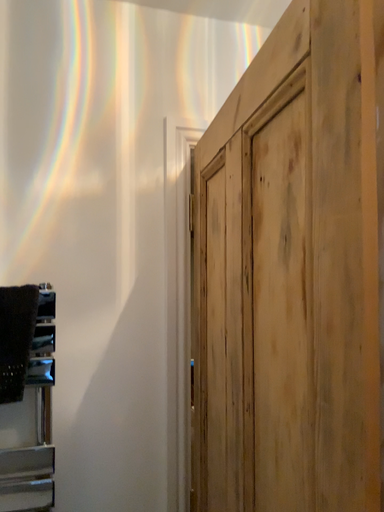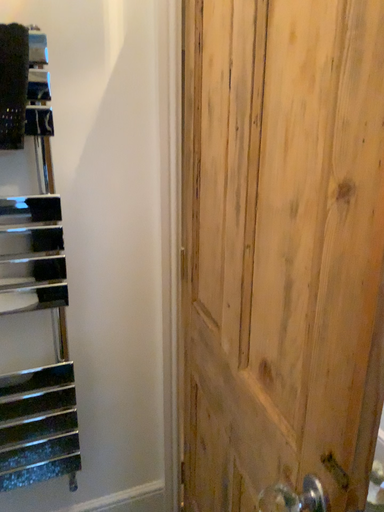
Question: Which way did the camera rotate in the video?

Choices:
 (A) rotated upward
 (B) rotated downward

Answer: (B)